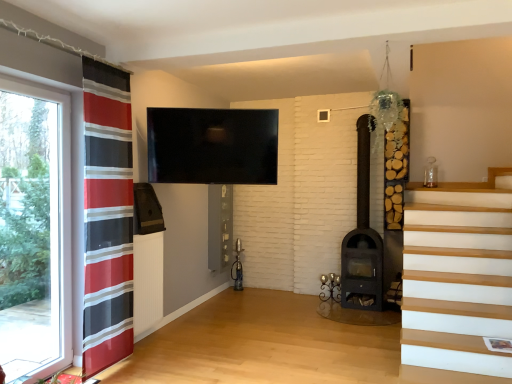
Question: Considering the relative sizes of red striped curtain at left and dark brown wood-burning stove at center-right in the image provided, is red striped curtain at left shorter than dark brown wood-burning stove at center-right?

Choices:
 (A) no
 (B) yes

Answer: (A)

Question: From a real-world perspective, is red striped curtain at left located higher than dark brown wood-burning stove at center-right?

Choices:
 (A) yes
 (B) no

Answer: (A)

Question: Does red striped curtain at left have a smaller size compared to dark brown wood-burning stove at center-right?

Choices:
 (A) no
 (B) yes

Answer: (B)

Question: Does red striped curtain at left appear on the right side of dark brown wood-burning stove at center-right?

Choices:
 (A) no
 (B) yes

Answer: (A)

Question: Is red striped curtain at left further to the viewer compared to dark brown wood-burning stove at center-right?

Choices:
 (A) no
 (B) yes

Answer: (A)

Question: In terms of size, does transparent glass window at left appear bigger or smaller than dark brown wood-burning stove at center-right?

Choices:
 (A) small
 (B) big

Answer: (A)

Question: Is transparent glass window at left to the left or to the right of dark brown wood-burning stove at center-right in the image?

Choices:
 (A) right
 (B) left

Answer: (B)

Question: Considering their positions, is transparent glass window at left located in front of or behind dark brown wood-burning stove at center-right?

Choices:
 (A) behind
 (B) front

Answer: (B)

Question: Looking at their shapes, would you say transparent glass window at left is wider or thinner than dark brown wood-burning stove at center-right?

Choices:
 (A) wide
 (B) thin

Answer: (B)

Question: Is dark brown wood-burning stove at center-right inside the boundaries of transparent glass window at left, or outside?

Choices:
 (A) inside
 (B) outside

Answer: (B)

Question: Looking at their shapes, would you say dark brown wood-burning stove at center-right is wider or thinner than transparent glass window at left?

Choices:
 (A) wide
 (B) thin

Answer: (A)

Question: Considering their positions, is dark brown wood-burning stove at center-right located in front of or behind transparent glass window at left?

Choices:
 (A) front
 (B) behind

Answer: (B)

Question: From the image's perspective, relative to transparent glass window at left, is dark brown wood-burning stove at center-right above or below?

Choices:
 (A) below
 (B) above

Answer: (B)

Question: Does point (353, 273) appear closer or farther from the camera than point (109, 299)?

Choices:
 (A) closer
 (B) farther

Answer: (B)

Question: Considering the positions of dark brown wood-burning stove at center-right and red striped curtain at left in the image, is dark brown wood-burning stove at center-right taller or shorter than red striped curtain at left?

Choices:
 (A) short
 (B) tall

Answer: (A)